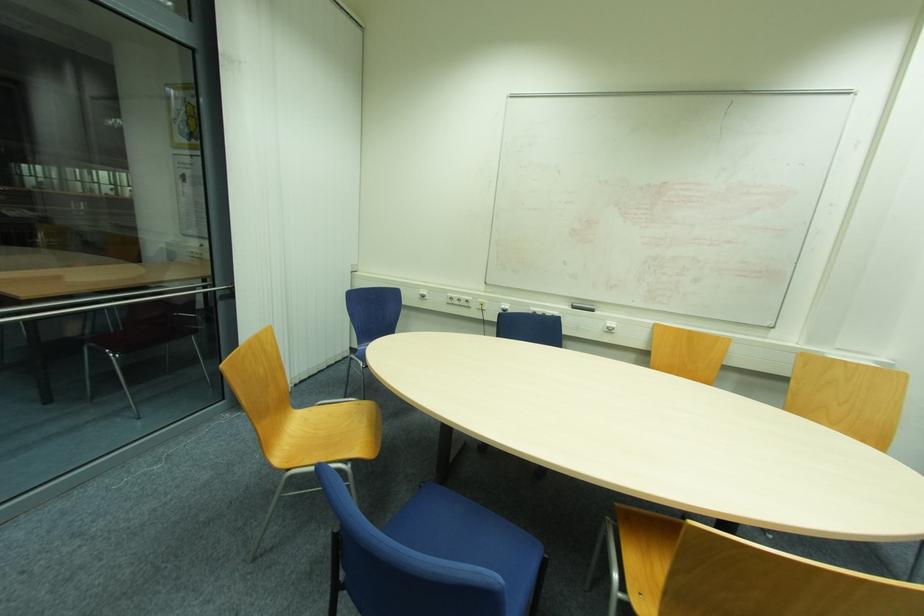
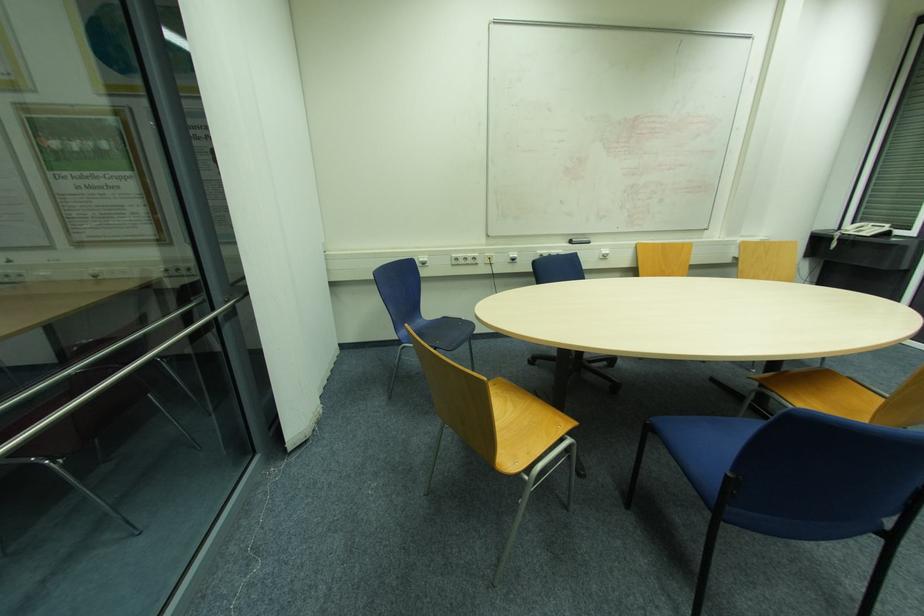
In the second image, find the point that corresponds to [460,301] in the first image.

(467, 259)